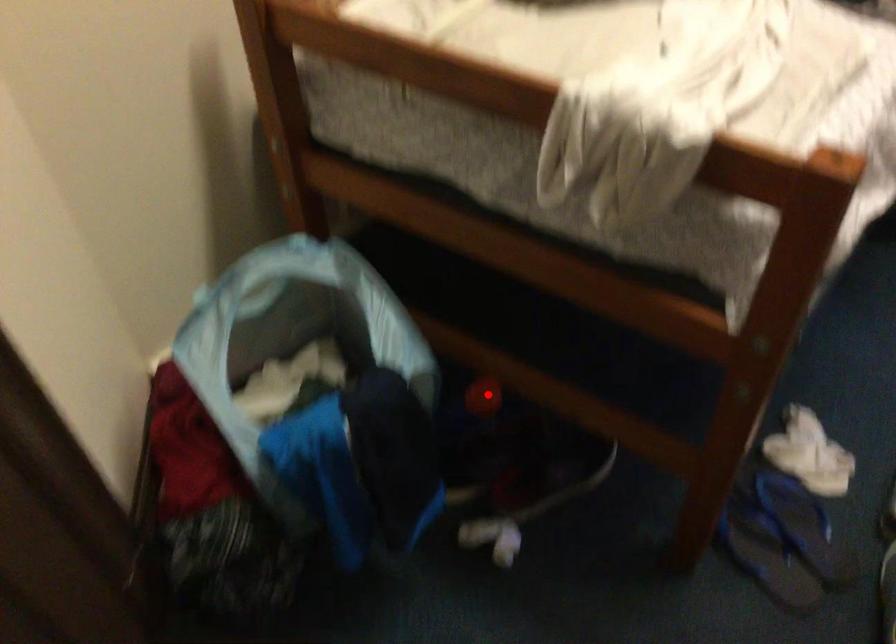
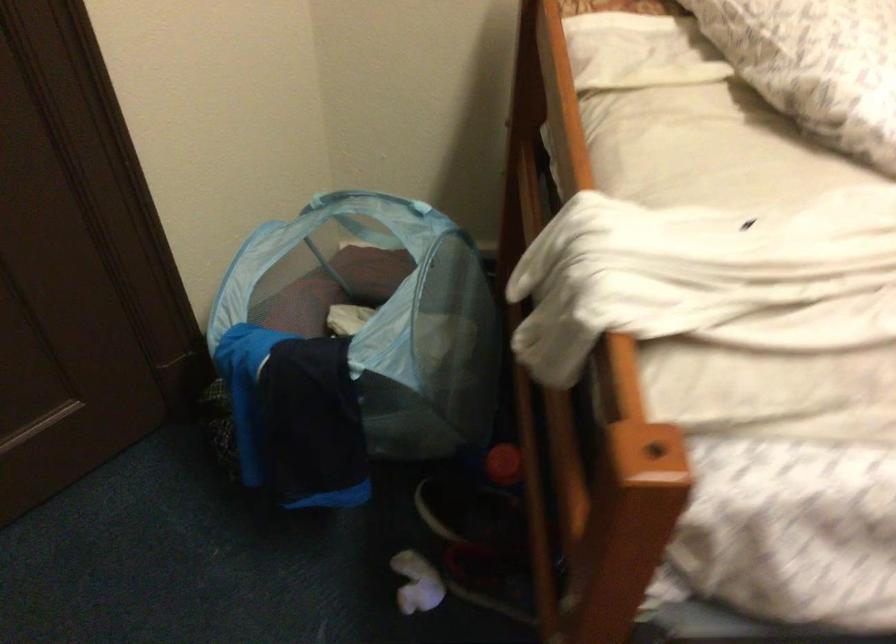
Question: I am providing you with two images of the same scene from different viewpoints. A red point is marked on the first image. At the location where the point appears in image 1, is it still visible in image 2?

Choices:
 (A) Yes
 (B) No

Answer: (A)